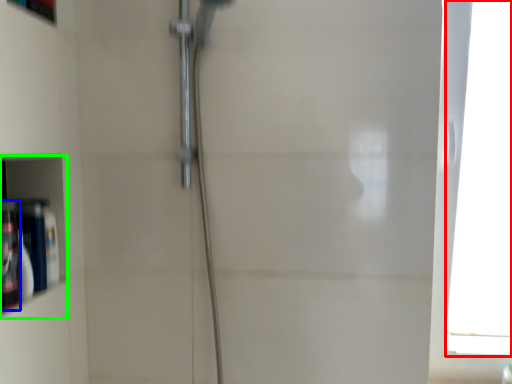
Question: Based on their relative distances, which object is nearer to window (highlighted by a red box)? Choose from toiletry (highlighted by a blue box) and cabinet (highlighted by a green box).

Choices:
 (A) toiletry
 (B) cabinet

Answer: (B)